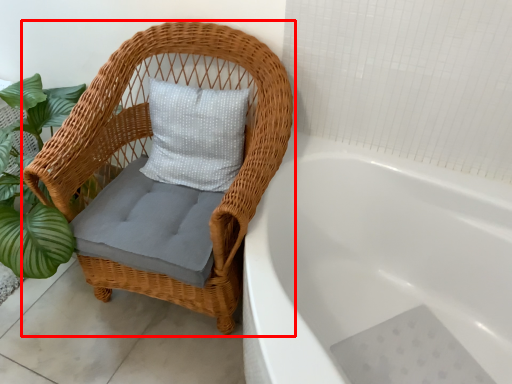
Question: From the image, what is the correct spatial relationship of chair (annotated by the red box) in relation to bathtub?

Choices:
 (A) right
 (B) left

Answer: (B)